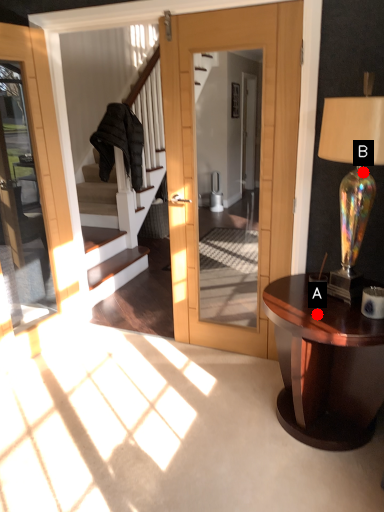
Question: Two points are circled on the image, labeled by A and B beside each circle. Which point is farther from the camera taking this photo?

Choices:
 (A) A is further
 (B) B is further

Answer: (B)